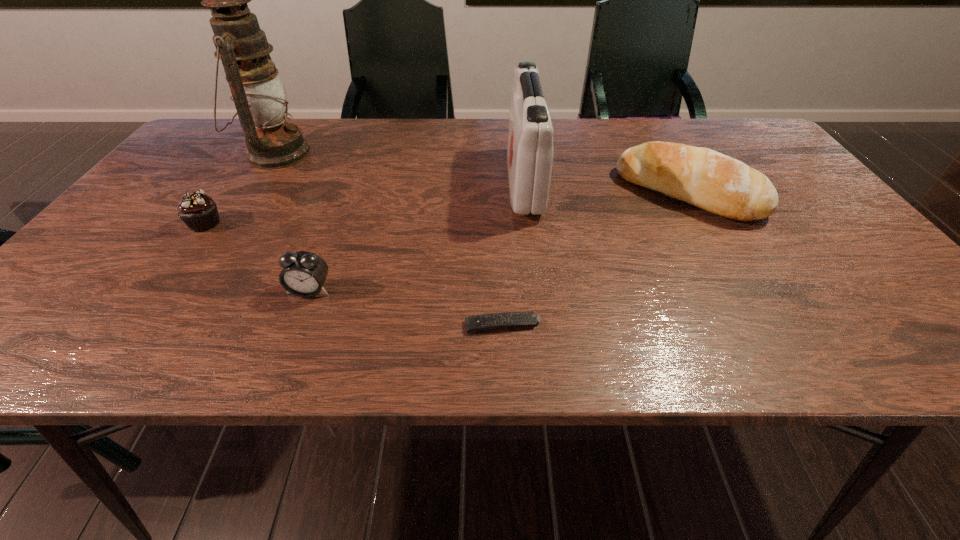
Where is `lantern positioned at the left edge`? The width and height of the screenshot is (960, 540). lantern positioned at the left edge is located at coordinates (258, 94).

At what (x,y) coordinates should I click in order to perform the action: click on cupcake that is at the left edge. Please return your answer as a coordinate pair (x, y). The width and height of the screenshot is (960, 540). Looking at the image, I should click on (198, 211).

Identify the location of object at the right edge. This screenshot has height=540, width=960. (717, 183).

Identify the location of object that is positioned at the far left corner. Image resolution: width=960 pixels, height=540 pixels. (258, 94).

I want to click on vacant space at the far edge of the desktop, so click(x=553, y=159).

This screenshot has width=960, height=540. What are the coordinates of `free spot at the near edge of the desktop` in the screenshot? It's located at (350, 330).

The width and height of the screenshot is (960, 540). In order to click on vacant space at the left edge of the desktop in this screenshot , I will do `click(127, 286)`.

Where is `vacant space at the right edge of the desktop`? vacant space at the right edge of the desktop is located at coordinates (790, 246).

Image resolution: width=960 pixels, height=540 pixels. In the image, there is a desktop. Find the location of `free space at the far left corner`. free space at the far left corner is located at coordinates (219, 137).

You are a GUI agent. You are given a task and a screenshot of the screen. Output one action in this format:
    pyautogui.click(x=<x>, y=<y>)
    Task: Click on the unoccupied position between the shortest object and the cupcake
    This screenshot has height=540, width=960.
    Given the screenshot: What is the action you would take?
    pyautogui.click(x=354, y=274)